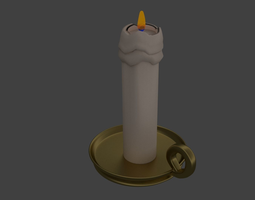
The width and height of the screenshot is (255, 200). What are the coordinates of `candle holder` in the screenshot? It's located at (117, 160).